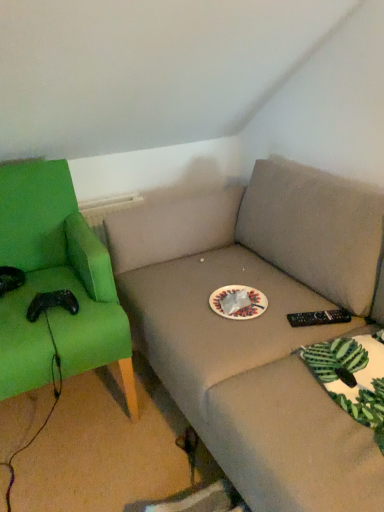
What do you see at coordinates (238, 302) in the screenshot?
I see `white paper plate at center` at bounding box center [238, 302].

The image size is (384, 512). In order to click on white paper plate at center in this screenshot , I will do `click(238, 302)`.

Image resolution: width=384 pixels, height=512 pixels. What do you see at coordinates (56, 283) in the screenshot? I see `green fabric chair at left` at bounding box center [56, 283].

Where is `green fabric chair at left`? The width and height of the screenshot is (384, 512). green fabric chair at left is located at coordinates (56, 283).

Where is `white paper plate at center`? The width and height of the screenshot is (384, 512). white paper plate at center is located at coordinates (238, 302).

Is green fabric chair at left at the right side of white paper plate at center?

No, green fabric chair at left is not to the right of white paper plate at center.

Considering the positions of objects green fabric chair at left and white paper plate at center in the image provided, who is in front, green fabric chair at left or white paper plate at center?

Positioned in front is green fabric chair at left.

Does point (17, 172) come closer to viewer compared to point (217, 295)?

No, it is behind (217, 295).

From the image's perspective, is green fabric chair at left beneath white paper plate at center?

Yes, from the image's perspective, green fabric chair at left is below white paper plate at center.

From the picture: From a real-world perspective, does green fabric chair at left stand above white paper plate at center?

No, from a real-world perspective, green fabric chair at left is not above white paper plate at center.

Which of these two, green fabric chair at left or white paper plate at center, is thinner?

white paper plate at center is thinner.

Considering the relative sizes of green fabric chair at left and white paper plate at center in the image provided, is green fabric chair at left taller than white paper plate at center?

Yes.

Who is smaller, green fabric chair at left or white paper plate at center?

With smaller size is white paper plate at center.

Would you say white paper plate at center is part of green fabric chair at left's contents?

No, white paper plate at center is not a part of green fabric chair at left.

Is green fabric chair at left touching white paper plate at center?

No, green fabric chair at left is not touching white paper plate at center.

Is green fabric chair at left positioned with its back to white paper plate at center?

green fabric chair at left is not turned away from white paper plate at center.

Where is `chair below the white paper plate at center (from the image's perspective)`? Image resolution: width=384 pixels, height=512 pixels. chair below the white paper plate at center (from the image's perspective) is located at coordinates (56, 283).

In the scene shown: Visually, is white paper plate at center positioned to the left or to the right of green fabric chair at left?

From the image, it's evident that white paper plate at center is to the right of green fabric chair at left.

Which object is further away from the camera, white paper plate at center or green fabric chair at left?

white paper plate at center is further from the camera.

Is point (246, 302) farther from viewer compared to point (93, 254)?

Yes.

In the scene shown: From the image's perspective, is white paper plate at center positioned above or below green fabric chair at left?

Clearly, from the image's perspective, white paper plate at center is above green fabric chair at left.

From a real-world perspective, is white paper plate at center physically located above or below green fabric chair at left?

From a real-world perspective, white paper plate at center is physically above green fabric chair at left.

Between white paper plate at center and green fabric chair at left, which one has larger width?

green fabric chair at left.

Can you confirm if white paper plate at center is taller than green fabric chair at left?

No, white paper plate at center is not taller than green fabric chair at left.

Is white paper plate at center bigger than green fabric chair at left?

Incorrect, white paper plate at center is not larger than green fabric chair at left.

Is green fabric chair at left inside white paper plate at center?

No, green fabric chair at left is located outside of white paper plate at center.

Is white paper plate at center not near green fabric chair at left?

No, there isn't a large distance between white paper plate at center and green fabric chair at left.

Is white paper plate at center oriented away from green fabric chair at left?

That's not correct — white paper plate at center is not looking away from green fabric chair at left.

The height and width of the screenshot is (512, 384). Identify the location of paper plate lying behind the green fabric chair at left. (238, 302).

Find the location of a particular element. This screenshot has height=512, width=384. chair in front of the white paper plate at center is located at coordinates (56, 283).

Identify the location of chair below the white paper plate at center (from the image's perspective). Image resolution: width=384 pixels, height=512 pixels. (56, 283).